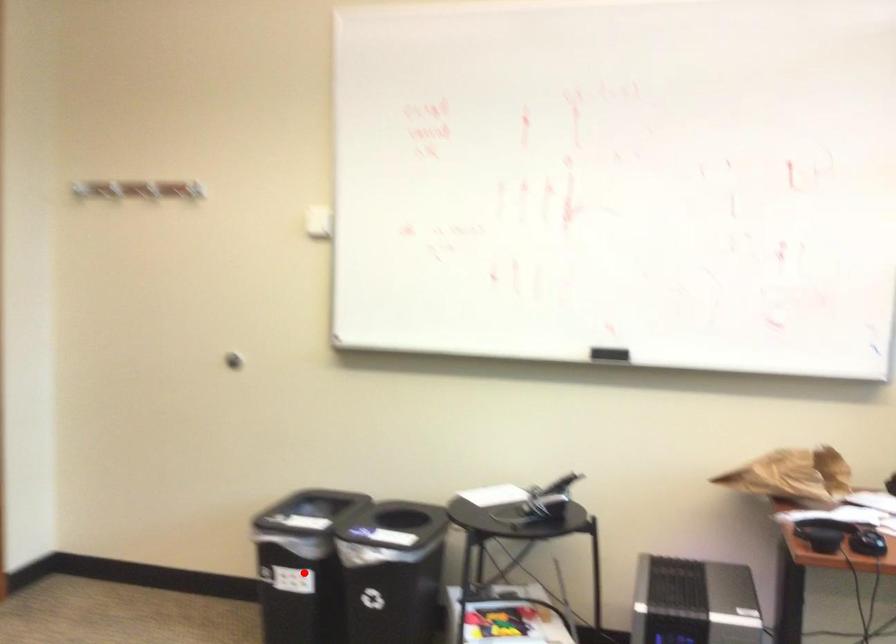
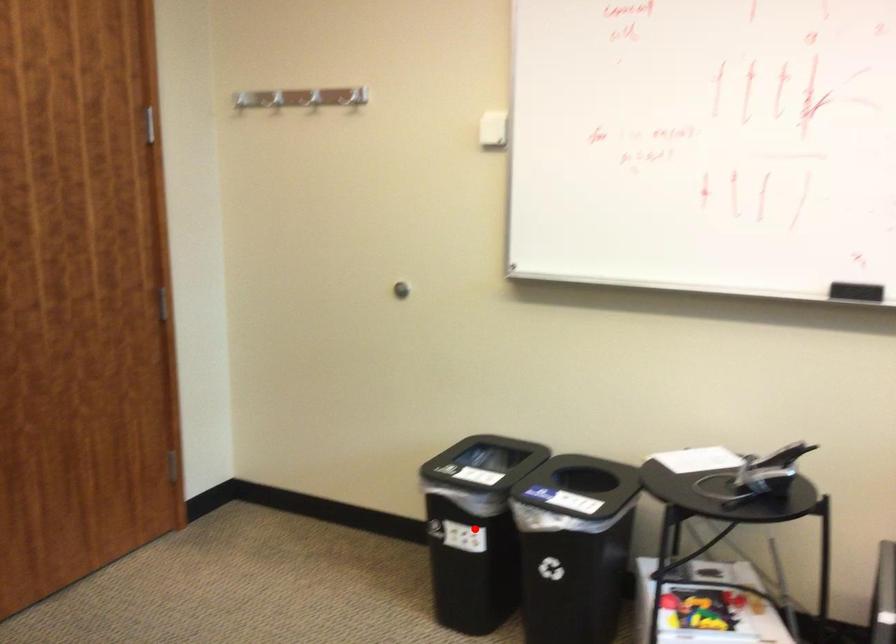
I am providing you with two images of the same scene from different viewpoints. A red point is marked on the first image and another point is marked on the second image. Are the points marked in image1 and image2 representing the same 3D position?

Yes